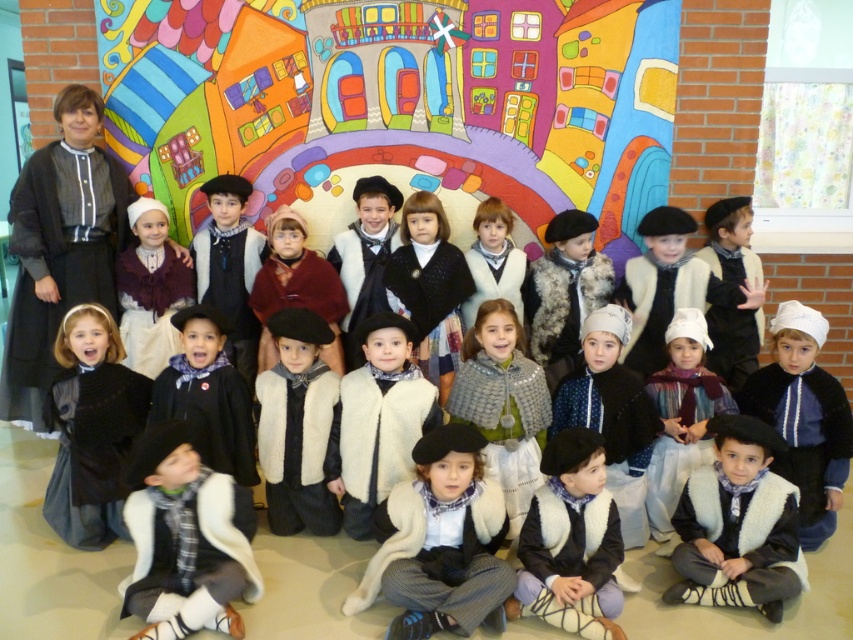
You are a photographer adjusting the camera settings to ensure all children are in focus. The camera has a depth of field that can only accommodate objects within a 15 cm width range. Given that the white woolen vest at lower left is narrower than the white woolen vest at center, can you confirm if both vests will be in focus?

The white woolen vest at lower left is narrower than the white woolen vest at center, but the exact width difference isn not provided. However, since the depth of field can accommodate up to 15 cm width range, if the difference between their widths is within 15 cm, they will both be in focus. Without specific measurements, it cannot be definitively confirmed.

You are a photographer trying to adjust the lighting for the group photo. You notice two items at the center of the image, the velvet black hat at center and the matte white dress at center. Which one is closer to the camera?

The velvet black hat at center is in front of the matte white dress at center, so it is closer to the camera.

You are a photographer standing 2 meters away from the velvet black hat at center in the scene. Can you reach it without moving your position?

The velvet black hat at center and viewer are 2.65 meters apart. Since you are standing 2 meters away, you are 0.65 meters closer than the stated distance, so you can reach it without moving.